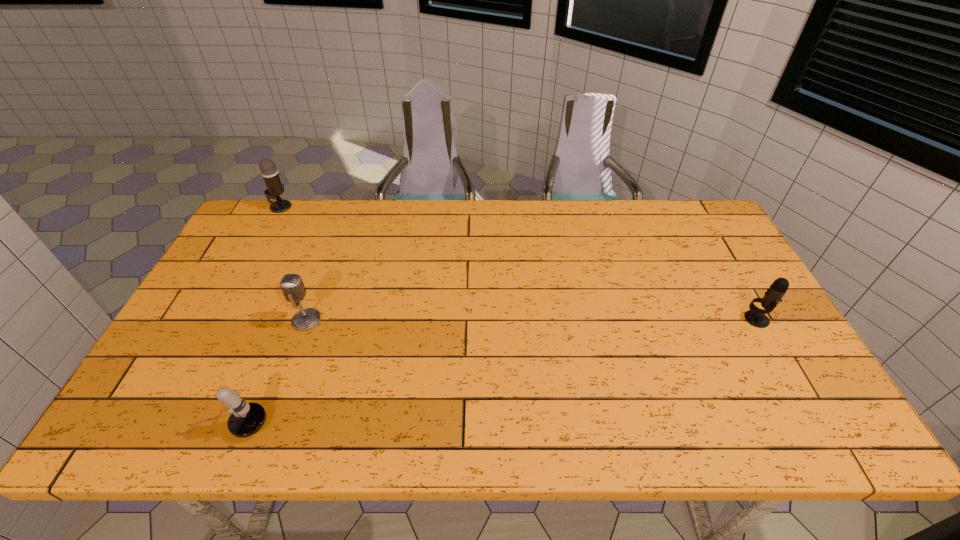
The width and height of the screenshot is (960, 540). Find the location of `vacant region between the nearest object and the leftmost object`. vacant region between the nearest object and the leftmost object is located at coordinates (253, 316).

The width and height of the screenshot is (960, 540). I want to click on free spot between the farthest microphone and the nearest object, so click(x=253, y=316).

Locate which object ranks in proximity to the rightmost microphone. Please provide its 2D coordinates. Your answer should be formatted as a tuple, i.e. [(x, y)], where the tuple contains the x and y coordinates of a point satisfying the conditions above.

[(293, 288)]

Identify which object is the third closest to the nearest microphone. Please provide its 2D coordinates. Your answer should be formatted as a tuple, i.e. [(x, y)], where the tuple contains the x and y coordinates of a point satisfying the conditions above.

[(755, 316)]

Identify the location of microphone object that ranks as the closest to the rightmost microphone. (293, 288).

Point out which microphone is positioned as the second nearest to the rightmost microphone. Please provide its 2D coordinates. Your answer should be formatted as a tuple, i.e. [(x, y)], where the tuple contains the x and y coordinates of a point satisfying the conditions above.

[(246, 419)]

You are a GUI agent. You are given a task and a screenshot of the screen. Output one action in this format:
    pyautogui.click(x=<x>, y=<y>)
    Task: Click on the vacant position in the image that satisfies the following two spatial constraints: 1. on the front side of the leftmost microphone; 2. on the left side of the nearest object
    This screenshot has width=960, height=540.
    Given the screenshot: What is the action you would take?
    pyautogui.click(x=163, y=425)

You are a GUI agent. You are given a task and a screenshot of the screen. Output one action in this format:
    pyautogui.click(x=<x>, y=<y>)
    Task: Click on the free location that satisfies the following two spatial constraints: 1. on the front side of the farthest object; 2. on the right side of the rightmost microphone
    
    Given the screenshot: What is the action you would take?
    pyautogui.click(x=220, y=319)